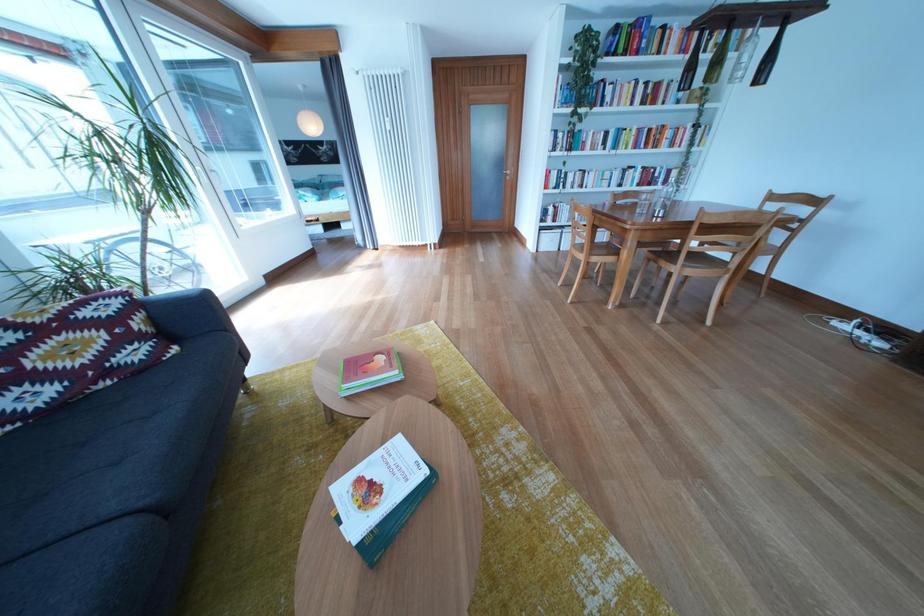
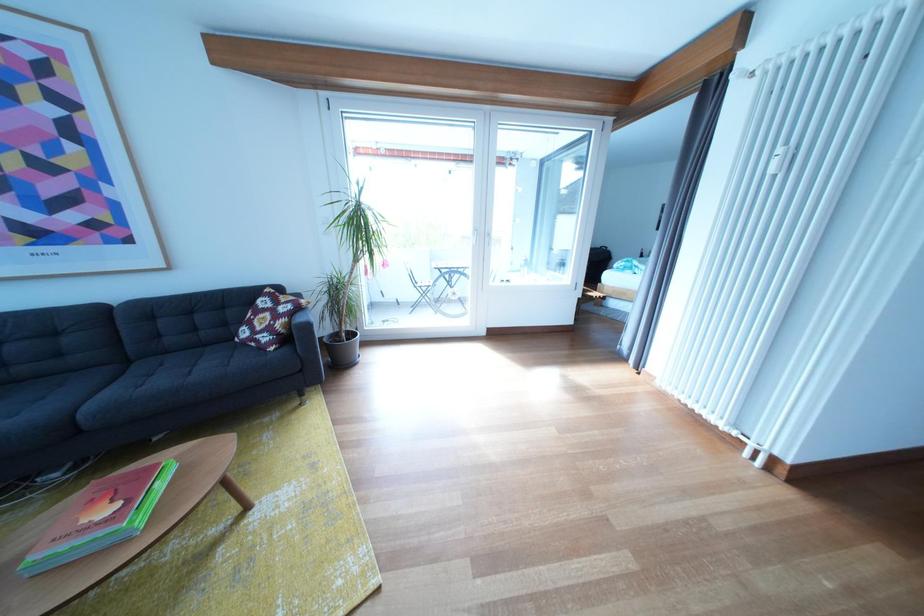
Find the pixel in the second image that matches [399,126] in the first image.

(793, 156)